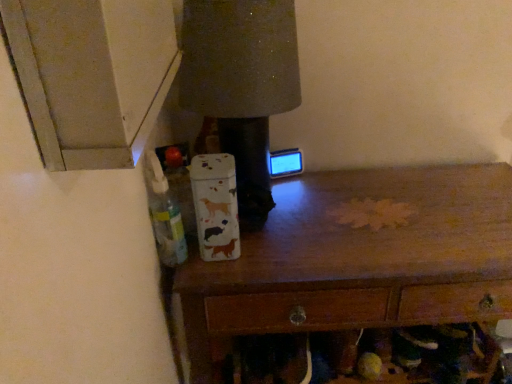
Question: From a real-world perspective, is wooden chest of drawers at center above or below translucent plastic bottle at left?

Choices:
 (A) above
 (B) below

Answer: (B)

Question: From the image's perspective, relative to translucent plastic bottle at left, is wooden chest of drawers at center above or below?

Choices:
 (A) below
 (B) above

Answer: (A)

Question: In terms of height, does wooden chest of drawers at center look taller or shorter compared to translucent plastic bottle at left?

Choices:
 (A) short
 (B) tall

Answer: (B)

Question: Is translucent plastic bottle at left wider or thinner than wooden chest of drawers at center?

Choices:
 (A) thin
 (B) wide

Answer: (A)

Question: Is translucent plastic bottle at left bigger or smaller than wooden chest of drawers at center?

Choices:
 (A) small
 (B) big

Answer: (A)

Question: Would you say translucent plastic bottle at left is inside or outside wooden chest of drawers at center?

Choices:
 (A) outside
 (B) inside

Answer: (A)

Question: Relative to wooden chest of drawers at center, is translucent plastic bottle at left in front or behind?

Choices:
 (A) behind
 (B) front

Answer: (B)